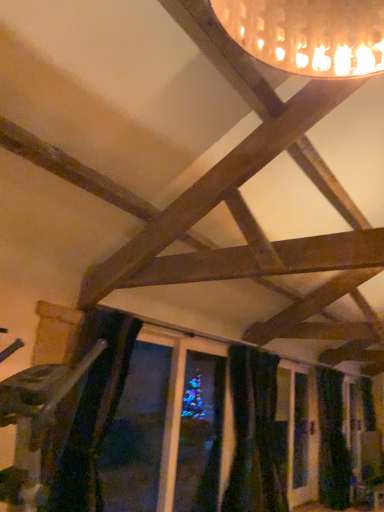
Question: Is dark blue velvet curtain at lower right, which is the 1th curtain in right-to-left order, positioned behind black velvet curtain at lower center, placed as the 1th curtain when sorted from front to back?

Choices:
 (A) no
 (B) yes

Answer: (B)

Question: Does dark blue velvet curtain at lower right, which is counted as the 2th curtain, starting from the front, have a lesser width compared to black velvet curtain at lower center, the second curtain viewed from the right?

Choices:
 (A) no
 (B) yes

Answer: (B)

Question: Is dark blue velvet curtain at lower right, which is the 1th curtain in right-to-left order, oriented towards black velvet curtain at lower center, the second curtain viewed from the right?

Choices:
 (A) no
 (B) yes

Answer: (A)

Question: From the image's perspective, does dark blue velvet curtain at lower right, which is counted as the 2th curtain, starting from the front, appear higher than black velvet curtain at lower center, which is the second curtain from back to front?

Choices:
 (A) no
 (B) yes

Answer: (A)

Question: Considering the relative sizes of dark blue velvet curtain at lower right, which is counted as the 2th curtain, starting from the front, and black velvet curtain at lower center, the second curtain viewed from the right, in the image provided, is dark blue velvet curtain at lower right, which is counted as the 2th curtain, starting from the front, wider than black velvet curtain at lower center, the second curtain viewed from the right,?

Choices:
 (A) no
 (B) yes

Answer: (A)

Question: From a real-world perspective, is dark blue velvet curtain at lower right, which is the 1th curtain in right-to-left order, positioned under black velvet curtain at lower center, placed as the 1th curtain when sorted from left to right, based on gravity?

Choices:
 (A) no
 (B) yes

Answer: (B)

Question: Can dark blue velvet curtain at lower right, which is counted as the 2th curtain, starting from the front, be found inside black velvet curtain at lower center, which is the second curtain from back to front?

Choices:
 (A) yes
 (B) no

Answer: (B)

Question: Does black velvet curtain at lower center, placed as the 1th curtain when sorted from left to right, come behind dark blue velvet curtain at lower right, which is counted as the 2th curtain, starting from the front?

Choices:
 (A) yes
 (B) no

Answer: (B)

Question: Is black velvet curtain at lower center, which is the second curtain from back to front, not inside dark blue velvet curtain at lower right, which is the 1th curtain in right-to-left order?

Choices:
 (A) yes
 (B) no

Answer: (A)

Question: Can you confirm if black velvet curtain at lower center, which is the second curtain from back to front, is shorter than dark blue velvet curtain at lower right, which is counted as the 2th curtain, starting from the front?

Choices:
 (A) no
 (B) yes

Answer: (B)

Question: Is black velvet curtain at lower center, which is the second curtain from back to front, oriented towards dark blue velvet curtain at lower right, positioned as the second curtain in left-to-right order?

Choices:
 (A) no
 (B) yes

Answer: (A)

Question: From the image's perspective, is black velvet curtain at lower center, which is the second curtain from back to front, over dark blue velvet curtain at lower right, positioned as the first curtain in back-to-front order?

Choices:
 (A) no
 (B) yes

Answer: (B)

Question: In the image, is black velvet curtain at lower center, placed as the 1th curtain when sorted from left to right, on the left side or the right side of dark blue velvet curtain at lower right, positioned as the second curtain in left-to-right order?

Choices:
 (A) left
 (B) right

Answer: (A)